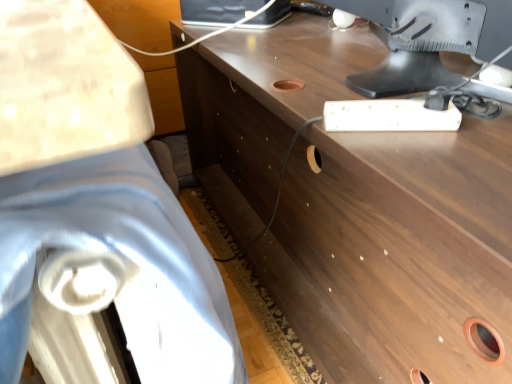
Question: Considering the relative positions of satin silver monitor at upper right and brown wood desk at center in the image provided, is satin silver monitor at upper right to the right of brown wood desk at center from the viewer's perspective?

Choices:
 (A) yes
 (B) no

Answer: (A)

Question: Is satin silver monitor at upper right behind brown wood desk at center?

Choices:
 (A) no
 (B) yes

Answer: (B)

Question: From a real-world perspective, is satin silver monitor at upper right located higher than brown wood desk at center?

Choices:
 (A) yes
 (B) no

Answer: (A)

Question: From a real-world perspective, is satin silver monitor at upper right under brown wood desk at center?

Choices:
 (A) no
 (B) yes

Answer: (A)

Question: Would you say satin silver monitor at upper right is a long distance from brown wood desk at center?

Choices:
 (A) no
 (B) yes

Answer: (A)

Question: Choose the correct answer: Is brown wood desk at center inside white fabric swivel chair at left or outside it?

Choices:
 (A) outside
 (B) inside

Answer: (A)

Question: Is brown wood desk at center taller or shorter than white fabric swivel chair at left?

Choices:
 (A) tall
 (B) short

Answer: (A)

Question: Looking at the image, does brown wood desk at center seem bigger or smaller compared to white fabric swivel chair at left?

Choices:
 (A) small
 (B) big

Answer: (B)

Question: In the image, is brown wood desk at center positioned in front of or behind white fabric swivel chair at left?

Choices:
 (A) front
 (B) behind

Answer: (B)

Question: From the image's perspective, is white fabric swivel chair at left located above or below satin silver monitor at upper right?

Choices:
 (A) above
 (B) below

Answer: (B)

Question: Considering the positions of white fabric swivel chair at left and satin silver monitor at upper right in the image, is white fabric swivel chair at left wider or thinner than satin silver monitor at upper right?

Choices:
 (A) wide
 (B) thin

Answer: (B)

Question: In terms of height, does white fabric swivel chair at left look taller or shorter compared to satin silver monitor at upper right?

Choices:
 (A) tall
 (B) short

Answer: (A)

Question: Based on their positions, is white fabric swivel chair at left located to the left or right of satin silver monitor at upper right?

Choices:
 (A) right
 (B) left

Answer: (B)

Question: Would you say satin silver monitor at upper right is inside or outside brown wood desk at center?

Choices:
 (A) outside
 (B) inside

Answer: (B)

Question: In the image, is satin silver monitor at upper right positioned in front of or behind brown wood desk at center?

Choices:
 (A) front
 (B) behind

Answer: (B)